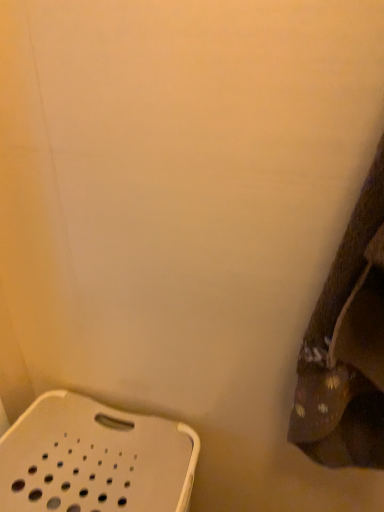
In order to click on white plastic stool at lower left in this screenshot , I will do `click(95, 459)`.

In order to face white plastic stool at lower left, should I rotate leftwards or rightwards?

Turn left approximately 11.219 degrees to face it.

What do you see at coordinates (95, 459) in the screenshot?
I see `white plastic stool at lower left` at bounding box center [95, 459].

Find the location of `white plastic stool at lower left`. white plastic stool at lower left is located at coordinates (95, 459).